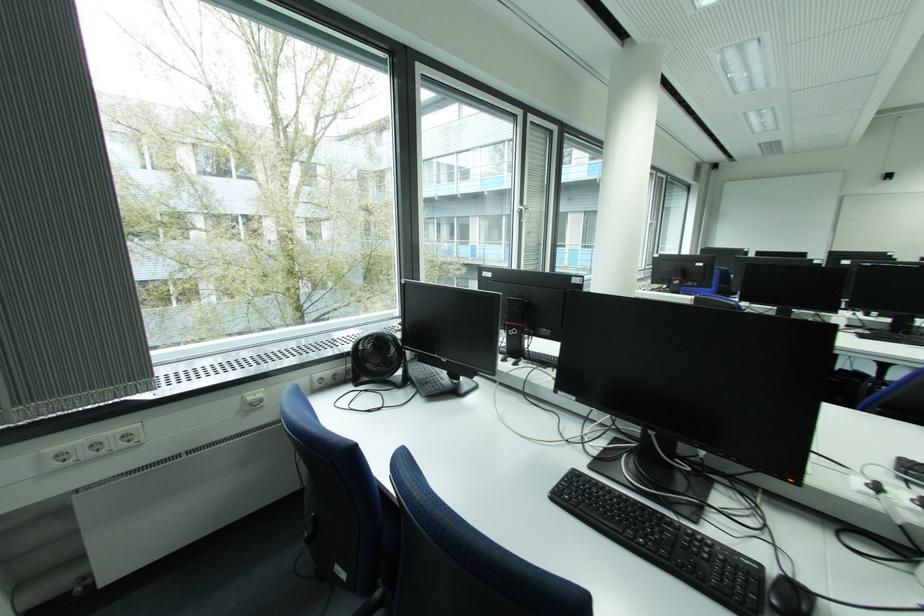
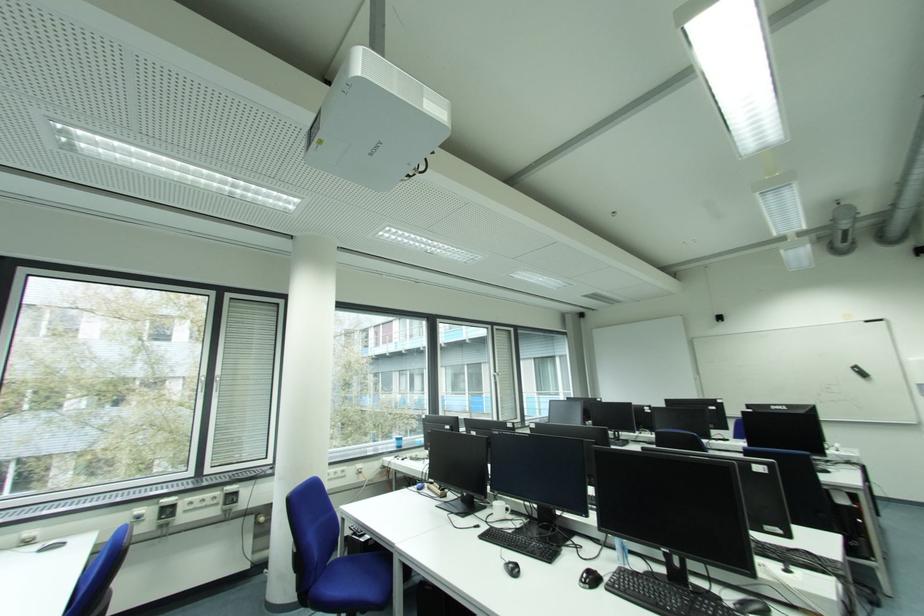
Question: What movement of the cameraman would produce the second image?

Choices:
 (A) Left
 (B) Right
 (C) Forward
 (D) Backward

Answer: (B)